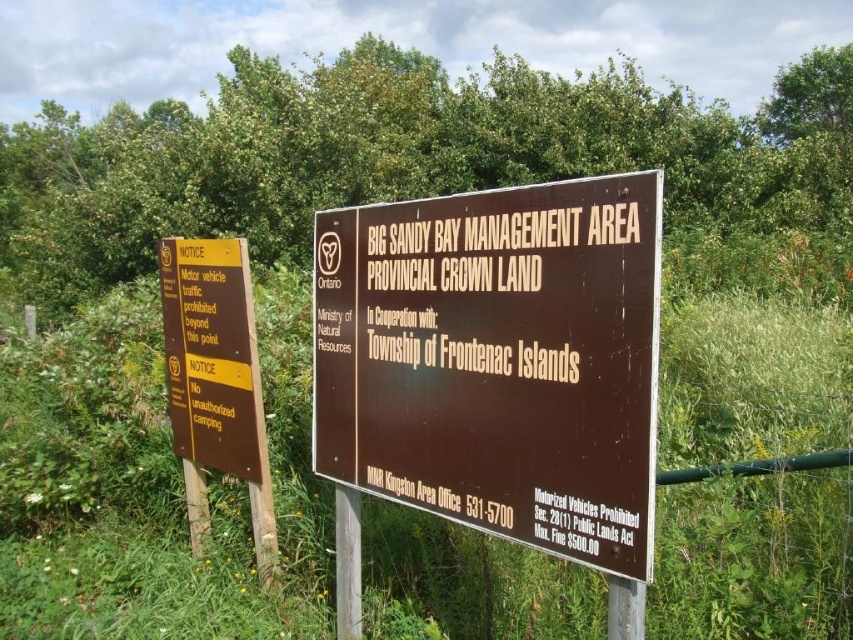
Question: Is brown wooden sign at center smaller than yellow paper at left?

Choices:
 (A) yes
 (B) no

Answer: (B)

Question: Does brown wooden sign at center lie in front of yellow paper at left?

Choices:
 (A) no
 (B) yes

Answer: (B)

Question: Among these objects, which one is farthest from the camera?

Choices:
 (A) yellow paper at left
 (B) brown wooden sign at center

Answer: (A)

Question: In this image, where is brown wooden sign at center located relative to yellow paper at left?

Choices:
 (A) above
 (B) below

Answer: (A)

Question: Which point is farther to the camera?

Choices:
 (A) brown wooden sign at center
 (B) yellow paper at left

Answer: (B)